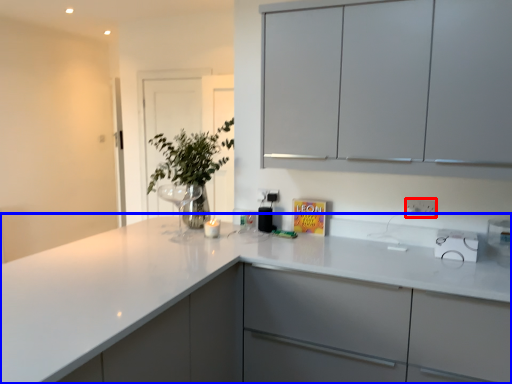
Question: Among these objects, which one is nearest to the camera, electric outlet (highlighted by a red box) or countertop (highlighted by a blue box)?

Choices:
 (A) electric outlet
 (B) countertop

Answer: (B)